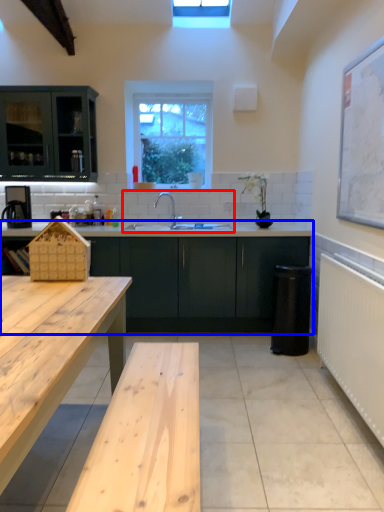
Question: Among these objects, which one is farthest to the camera, sink (highlighted by a red box) or cabinetry (highlighted by a blue box)?

Choices:
 (A) sink
 (B) cabinetry

Answer: (A)